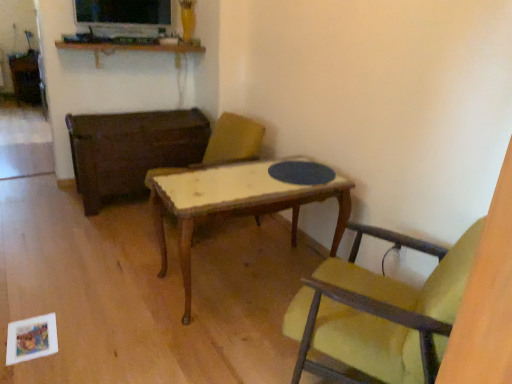
Question: From a real-world perspective, is wooden textured chair at center, the first chair in the back-to-front sequence, above or below wooden shelf at upper center?

Choices:
 (A) below
 (B) above

Answer: (A)

Question: Looking at their shapes, would you say wooden textured chair at center, the 2th chair in the right-to-left sequence, is wider or thinner than wooden shelf at upper center?

Choices:
 (A) thin
 (B) wide

Answer: (B)

Question: Which is farther from the wooden table at center?

Choices:
 (A) wooden shelf at upper center
 (B) yellow fabric chair at center, acting as the 1th chair starting from the right
 (C) wooden textured chair at center, which ranks as the 2th chair in front-to-back order

Answer: (B)

Question: Estimate the real-world distances between objects in this image. Which object is farther from the wooden table at center?

Choices:
 (A) yellow fabric chair at center, which is the second chair in back-to-front order
 (B) wooden textured chair at center, which ranks as the 2th chair in front-to-back order
 (C) wooden shelf at upper center

Answer: (A)